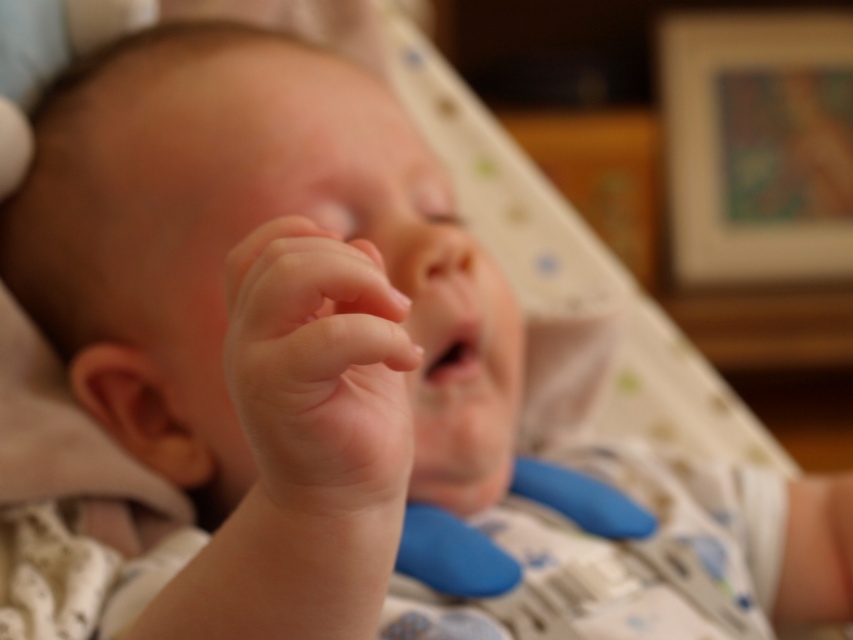
Image resolution: width=853 pixels, height=640 pixels. Identify the location of smooth flesh hand at center. (318, 372).